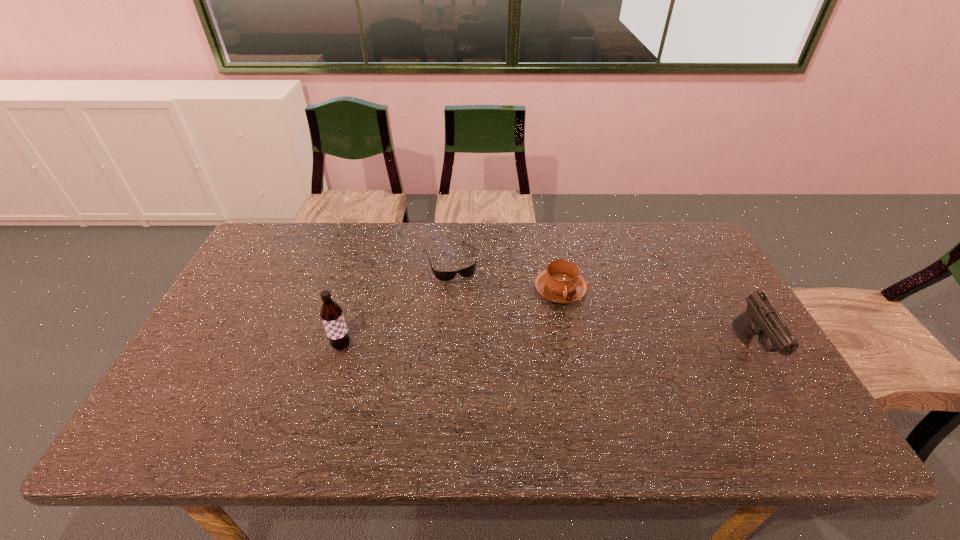
Locate an element on the screen. The height and width of the screenshot is (540, 960). free space on the desktop that is between the root beer and the second tallest object and is positioned on the side of the second object from right to left with the handle is located at coordinates (603, 348).

The image size is (960, 540). I want to click on free space on the desktop that is between the leftmost object and the pistol and is positioned on the front-facing side of the sunglasses, so click(x=487, y=347).